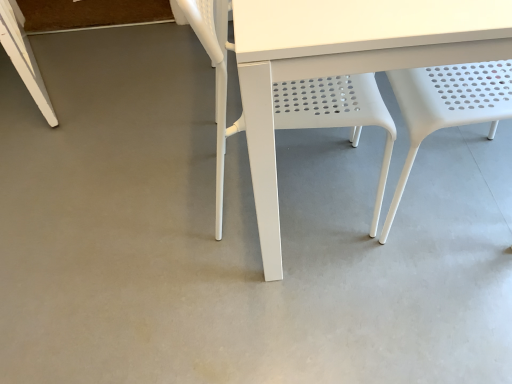
Question: Is white perforated plastic chair at center, which is the first chair in right-to-left order, at the back of white plastic chair at center, placed as the first chair when sorted from left to right?

Choices:
 (A) no
 (B) yes

Answer: (A)

Question: Is white perforated plastic chair at center, the second chair from the left, a part of white plastic chair at center, which appears as the 2th chair when viewed from the right?

Choices:
 (A) yes
 (B) no

Answer: (B)

Question: Is white plastic chair at center, which appears as the 2th chair when viewed from the right, next to white perforated plastic chair at center, which is the first chair in right-to-left order?

Choices:
 (A) no
 (B) yes

Answer: (A)

Question: Is white plastic chair at center, which appears as the 2th chair when viewed from the right, completely or partially outside of white perforated plastic chair at center, which is the first chair in right-to-left order?

Choices:
 (A) yes
 (B) no

Answer: (A)

Question: Could you tell me if white plastic chair at center, which appears as the 2th chair when viewed from the right, is turned towards white perforated plastic chair at center, which is the first chair in right-to-left order?

Choices:
 (A) yes
 (B) no

Answer: (A)

Question: Is the depth of white plastic chair at center, placed as the first chair when sorted from left to right, greater than that of white perforated plastic chair at center, which is the first chair in right-to-left order?

Choices:
 (A) yes
 (B) no

Answer: (A)

Question: From the image's perspective, is white perforated plastic chair at center, the second chair from the left, on white plastic chair at center, placed as the first chair when sorted from left to right?

Choices:
 (A) no
 (B) yes

Answer: (B)

Question: Is white perforated plastic chair at center, which is the first chair in right-to-left order, surrounding white plastic chair at center, placed as the first chair when sorted from left to right?

Choices:
 (A) no
 (B) yes

Answer: (A)

Question: Considering the relative sizes of white perforated plastic chair at center, which is the first chair in right-to-left order, and white plastic chair at center, which appears as the 2th chair when viewed from the right, in the image provided, is white perforated plastic chair at center, which is the first chair in right-to-left order, wider than white plastic chair at center, which appears as the 2th chair when viewed from the right,?

Choices:
 (A) no
 (B) yes

Answer: (A)

Question: Does white perforated plastic chair at center, which is the first chair in right-to-left order, come behind white plastic chair at center, placed as the first chair when sorted from left to right?

Choices:
 (A) yes
 (B) no

Answer: (B)

Question: Does white perforated plastic chair at center, the second chair from the left, turn towards white plastic chair at center, placed as the first chair when sorted from left to right?

Choices:
 (A) no
 (B) yes

Answer: (B)

Question: Can you confirm if white perforated plastic chair at center, which is the first chair in right-to-left order, is taller than white plastic chair at center, which appears as the 2th chair when viewed from the right?

Choices:
 (A) yes
 (B) no

Answer: (B)

Question: Based on their sizes in the image, would you say white plastic chair at center, placed as the first chair when sorted from left to right, is bigger or smaller than white perforated plastic chair at center, the second chair from the left?

Choices:
 (A) big
 (B) small

Answer: (A)